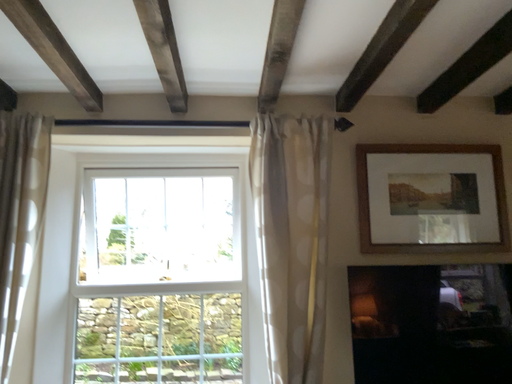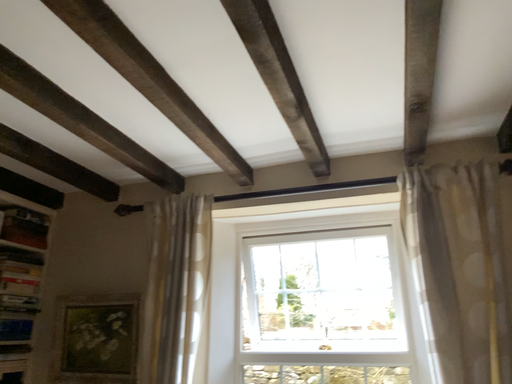
Question: Which way did the camera rotate in the video?

Choices:
 (A) rotated upward
 (B) rotated downward

Answer: (A)